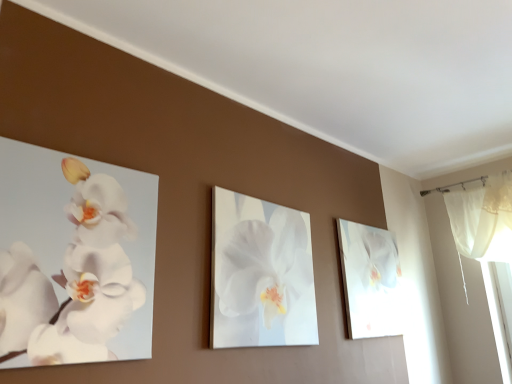
Question: Is white glossy orchid at center, the 2th flower positioned from the front, bigger than white matte orchid at left, which appears as the first flower when viewed from the left?

Choices:
 (A) yes
 (B) no

Answer: (A)

Question: Does white glossy orchid at center, the 2th flower positioned from the left, touch white matte orchid at left, which appears as the first flower when viewed from the left?

Choices:
 (A) yes
 (B) no

Answer: (B)

Question: From a real-world perspective, is white glossy orchid at center, the 2th flower positioned from the left, positioned under white matte orchid at left, marked as the 2th flower in a right-to-left arrangement, based on gravity?

Choices:
 (A) no
 (B) yes

Answer: (A)

Question: Is white matte orchid at left, arranged as the second flower when viewed from the back, surrounded by white glossy orchid at center, the 2th flower positioned from the front?

Choices:
 (A) no
 (B) yes

Answer: (A)

Question: Considering the relative sizes of white glossy orchid at center, the 2th flower positioned from the left, and white matte orchid at left, marked as the 2th flower in a right-to-left arrangement, in the image provided, is white glossy orchid at center, the 2th flower positioned from the left, taller than white matte orchid at left, marked as the 2th flower in a right-to-left arrangement,?

Choices:
 (A) yes
 (B) no

Answer: (A)

Question: Are white glossy orchid at center, the 2th flower positioned from the left, and white matte orchid at left, which is the 1th flower from front to back, far apart?

Choices:
 (A) no
 (B) yes

Answer: (A)

Question: Considering the relative sizes of white glossy orchid painting at right and white glossy orchid at center, the 2th flower positioned from the left, in the image provided, is white glossy orchid painting at right taller than white glossy orchid at center, the 2th flower positioned from the left,?

Choices:
 (A) no
 (B) yes

Answer: (A)

Question: Is white glossy orchid painting at right wider than white glossy orchid at center, the 2th flower positioned from the left?

Choices:
 (A) yes
 (B) no

Answer: (A)

Question: Are white glossy orchid painting at right and white glossy orchid at center, which is the first flower from right to left, located far from each other?

Choices:
 (A) yes
 (B) no

Answer: (B)

Question: Considering the relative positions of white glossy orchid painting at right and white glossy orchid at center, the 2th flower positioned from the front, in the image provided, is white glossy orchid painting at right to the left of white glossy orchid at center, the 2th flower positioned from the front, from the viewer's perspective?

Choices:
 (A) yes
 (B) no

Answer: (B)

Question: Is white glossy orchid painting at right bigger than white glossy orchid at center, which is the first flower from right to left?

Choices:
 (A) no
 (B) yes

Answer: (B)

Question: Is white glossy orchid at center, the 2th flower positioned from the front, at the back of white glossy orchid painting at right?

Choices:
 (A) no
 (B) yes

Answer: (A)

Question: From a real-world perspective, is white matte orchid at left, which appears as the first flower when viewed from the left, on top of white glossy orchid painting at right?

Choices:
 (A) yes
 (B) no

Answer: (B)